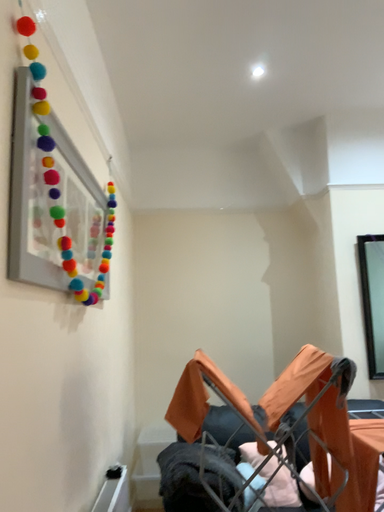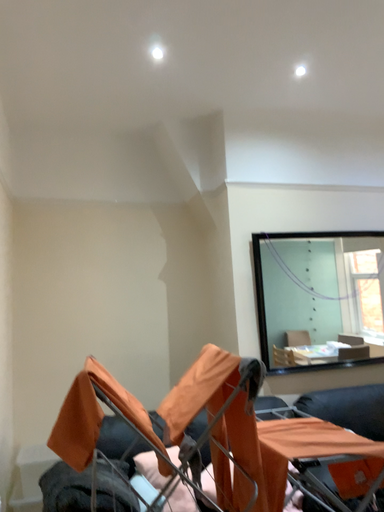
Question: How did the camera likely rotate when shooting the video?

Choices:
 (A) rotated right
 (B) rotated left

Answer: (A)